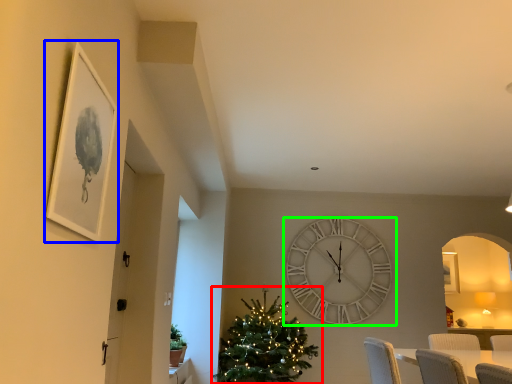
Question: Which object is positioned farthest from christmas tree (highlighted by a red box)? Select from picture frame (highlighted by a blue box) and wall clock (highlighted by a green box).

Choices:
 (A) picture frame
 (B) wall clock

Answer: (A)